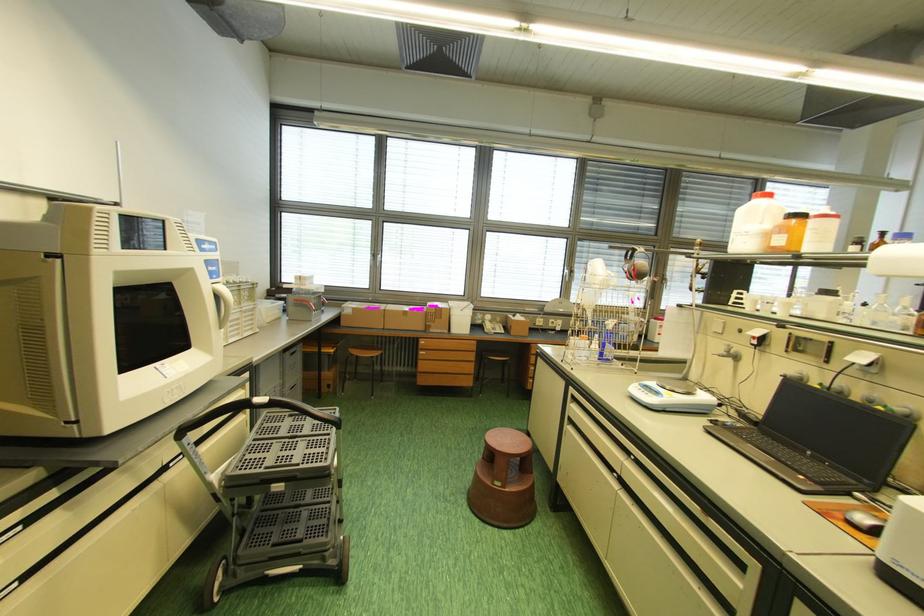
Find the location of a particular element. This screenshot has width=924, height=616. telephone handset is located at coordinates (492, 325).